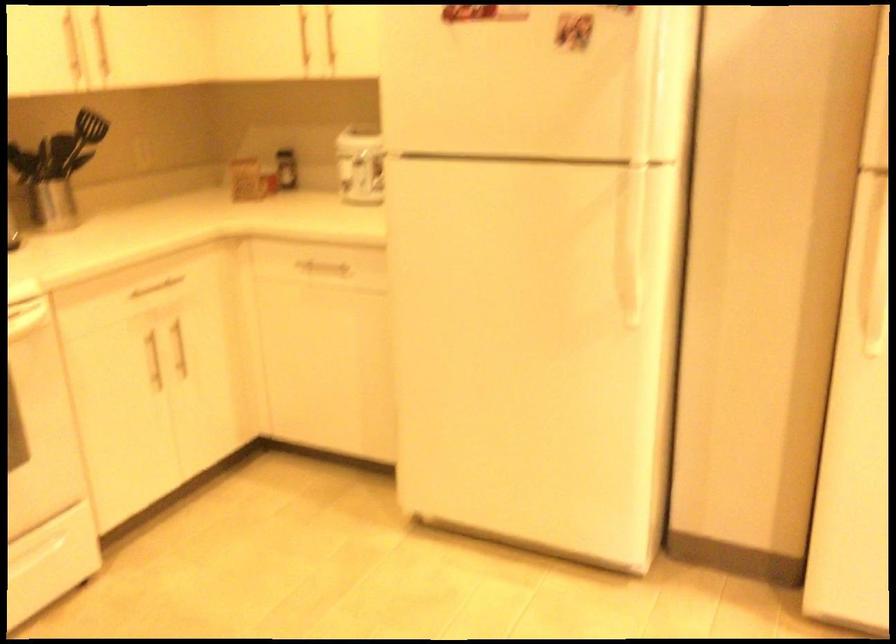
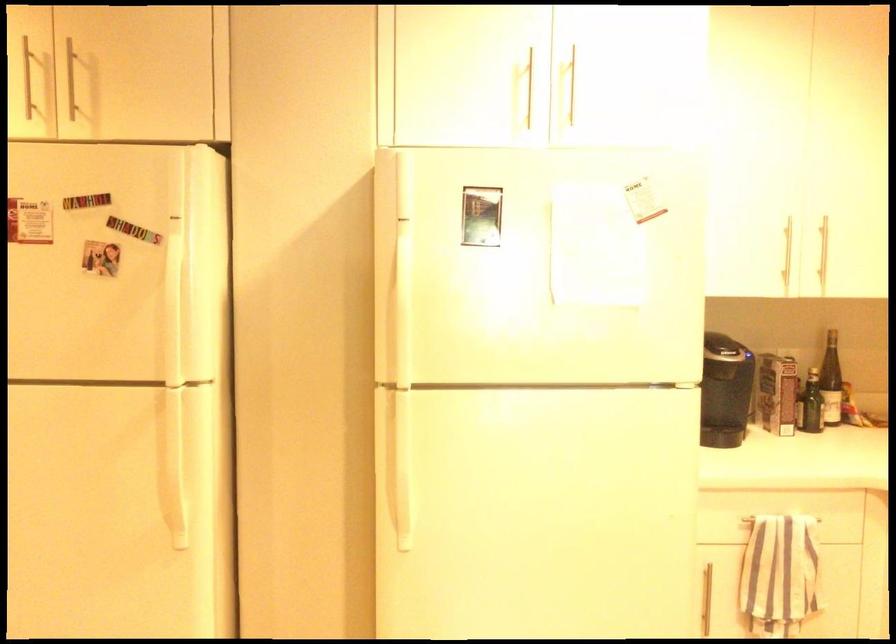
The point at (644, 79) is marked in the first image. Where is the corresponding point in the second image?

(177, 299)